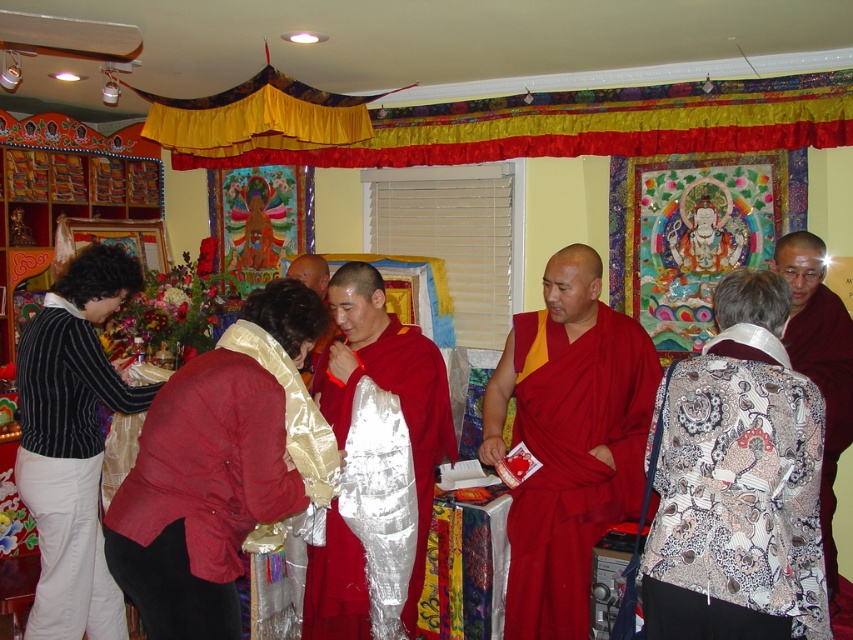
Consider the image. Which is below, red satin robe at center or matte red robe at center?

matte red robe at center

This screenshot has width=853, height=640. In order to click on red satin robe at center in this screenshot , I will do `click(215, 481)`.

In order to click on red satin robe at center in this screenshot , I will do `click(215, 481)`.

Does matte red robe at center lie behind shiny red robe at center?

No, it is in front of shiny red robe at center.

Which of these two, matte red robe at center or shiny red robe at center, stands shorter?

shiny red robe at center

The image size is (853, 640). What do you see at coordinates (573, 460) in the screenshot?
I see `matte red robe at center` at bounding box center [573, 460].

What are the coordinates of `matte red robe at center` in the screenshot? It's located at (573, 460).

Does striped wool sweater at lower left come in front of silky red robe at center?

That is True.

Which is behind, point (80, 376) or point (821, 356)?

Positioned behind is point (821, 356).

Find the location of `striped wool sweater at lower left`. striped wool sweater at lower left is located at coordinates 68,464.

At what (x,y) coordinates should I click in order to perform the action: click on striped wool sweater at lower left. Please return your answer as a coordinate pair (x, y). Looking at the image, I should click on (68, 464).